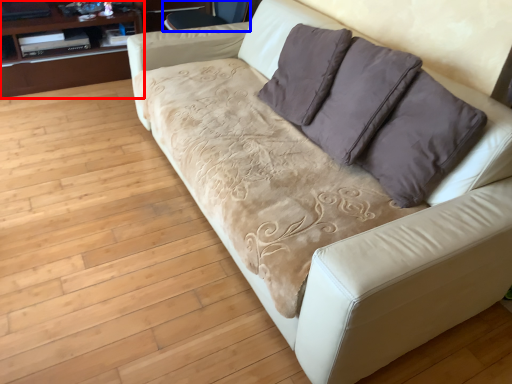
Question: Which point is further to the camera, dresser (highlighted by a red box) or armchair (highlighted by a blue box)?

Choices:
 (A) dresser
 (B) armchair

Answer: (A)